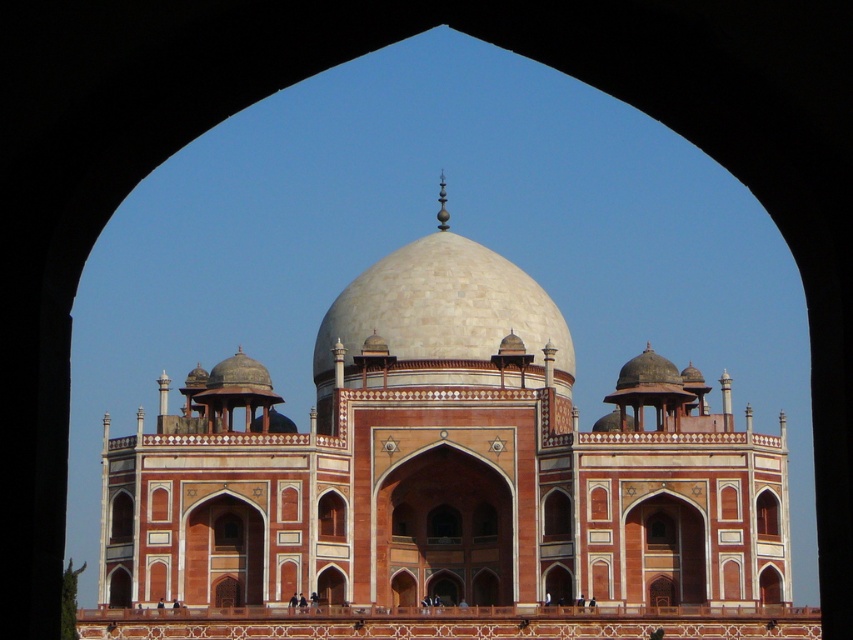
Consider the image. You are an architect visiting a historical site. You observe the beige stone mosque at center and the white marble dome at center. Which structure would require a larger foundation to support its weight?

The beige stone mosque at center is larger in size than the white marble dome at center, so it would require a larger foundation to support its weight.

Based on the photo, you are an architect analyzing the structure of the beige stone mosque at center and the white marble dome at center. Which one is positioned lower in the image?

The beige stone mosque at center is positioned below the white marble dome at center, so it is lower in the image.

You are an architect analyzing the symmetry of the beige stone mosque at center and the white marble dome at center. Which structure is wider?

The beige stone mosque at center is wider than the white marble dome at center.